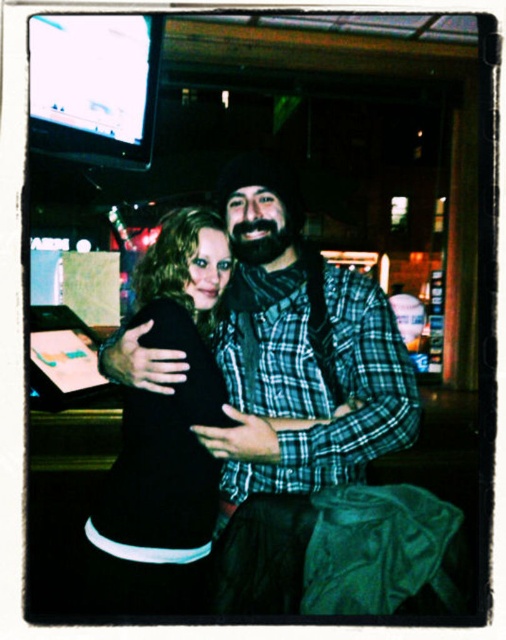
Question: Does plaid flannel shirt at center appear on the right side of black matte dress at center?

Choices:
 (A) yes
 (B) no

Answer: (A)

Question: Among these points, which one is farthest from the camera?

Choices:
 (A) (194, 275)
 (B) (383, 416)

Answer: (A)

Question: Can you confirm if plaid flannel shirt at center is thinner than black matte dress at center?

Choices:
 (A) yes
 (B) no

Answer: (B)

Question: Does plaid flannel shirt at center have a greater width compared to black matte dress at center?

Choices:
 (A) no
 (B) yes

Answer: (B)